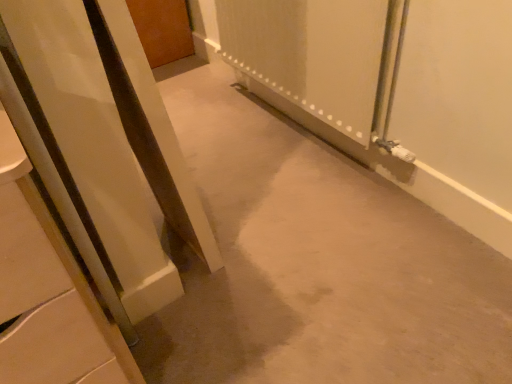
What do you see at coordinates (48, 293) in the screenshot? The height and width of the screenshot is (384, 512). I see `wooden drawer at left` at bounding box center [48, 293].

The height and width of the screenshot is (384, 512). Find the location of `wooden drawer at left`. wooden drawer at left is located at coordinates (48, 293).

At what (x,y) coordinates should I click in order to perform the action: click on wooden drawer at left. Please return your answer as a coordinate pair (x, y). Looking at the image, I should click on (48, 293).